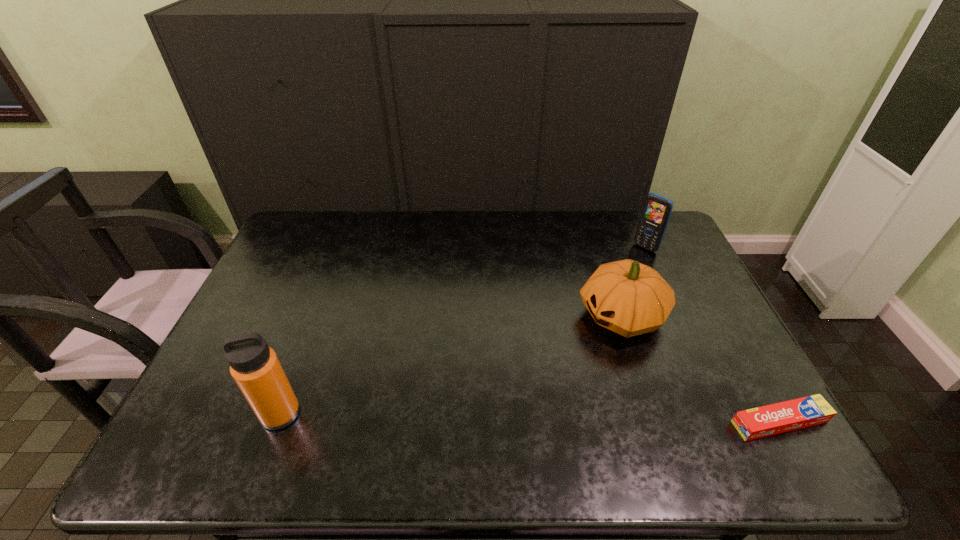
Image resolution: width=960 pixels, height=540 pixels. Identify the location of vacant area situated 0.400m on the screen of the farthest object. (572, 315).

This screenshot has height=540, width=960. What are the coordinates of `free spot located on the screen of the farthest object` in the screenshot? It's located at (618, 272).

At what (x,y) coordinates should I click in order to perform the action: click on vacant space located 0.400m on the screen of the farthest object. Please return your answer as a coordinate pair (x, y). Image resolution: width=960 pixels, height=540 pixels. Looking at the image, I should click on (572, 315).

Find the location of a particular element. The image size is (960, 540). object that is positioned at the far edge is located at coordinates (657, 209).

This screenshot has height=540, width=960. Find the location of `thermos bottle positioned at the near edge`. thermos bottle positioned at the near edge is located at coordinates (255, 367).

The width and height of the screenshot is (960, 540). I want to click on toothpaste situated at the near edge, so click(x=768, y=420).

Image resolution: width=960 pixels, height=540 pixels. Find the location of `toothpaste that is at the right edge`. toothpaste that is at the right edge is located at coordinates (768, 420).

This screenshot has width=960, height=540. Identify the location of gourd situated at the right edge. (629, 298).

You are a GUI agent. You are given a task and a screenshot of the screen. Output one action in this format:
    pyautogui.click(x=<x>, y=<y>)
    Task: Click on the cellular telephone that is at the right edge
    Image resolution: width=960 pixels, height=540 pixels.
    Given the screenshot: What is the action you would take?
    pyautogui.click(x=657, y=209)

The height and width of the screenshot is (540, 960). Identify the location of object at the far right corner. (657, 209).